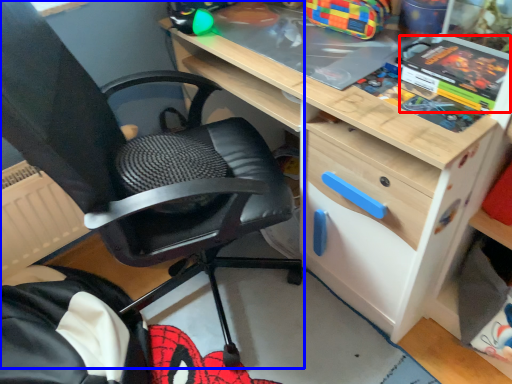
Question: Which of the following is the farthest to the observer, comic book (highlighted by a red box) or chair (highlighted by a blue box)?

Choices:
 (A) comic book
 (B) chair

Answer: (A)